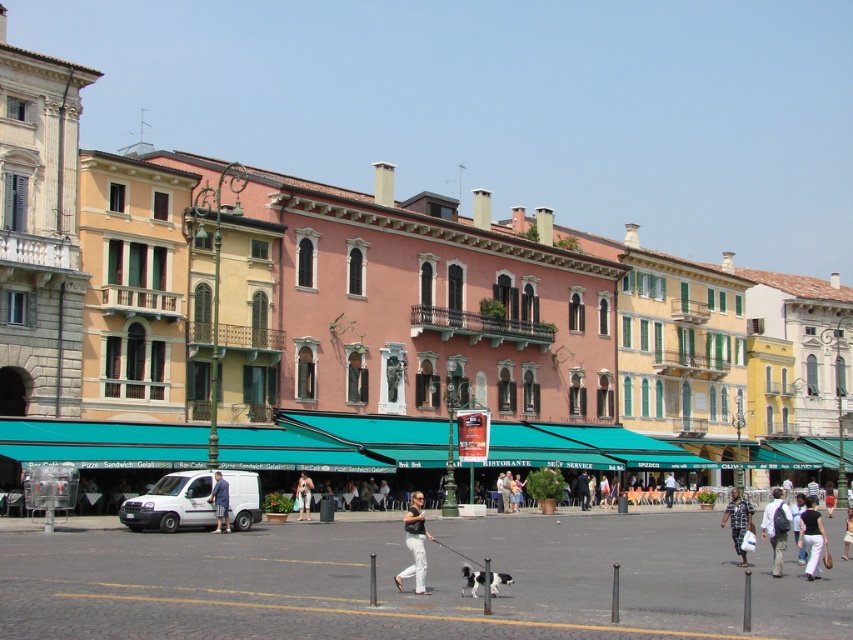
Question: Which point is closer to the camera?

Choices:
 (A) white cotton pants at center
 (B) white cotton shirt at center
 (C) blue denim jeans at center

Answer: (A)

Question: Among these objects, which one is farthest from the camera?

Choices:
 (A) white cotton pants at lower right
 (B) plaid shirt at center
 (C) light brown backpack at lower right

Answer: (B)

Question: Can you confirm if light brown backpack at lower right is bigger than plaid shirt at center?

Choices:
 (A) no
 (B) yes

Answer: (A)

Question: Is white cotton pants at center wider than white cotton shirt at center?

Choices:
 (A) yes
 (B) no

Answer: (A)

Question: Does white cotton pants at center appear under plaid shirt at center?

Choices:
 (A) no
 (B) yes

Answer: (A)

Question: Among these points, which one is farthest from the camera?

Choices:
 (A) (735, 528)
 (B) (213, 499)
 (C) (810, 515)

Answer: (B)